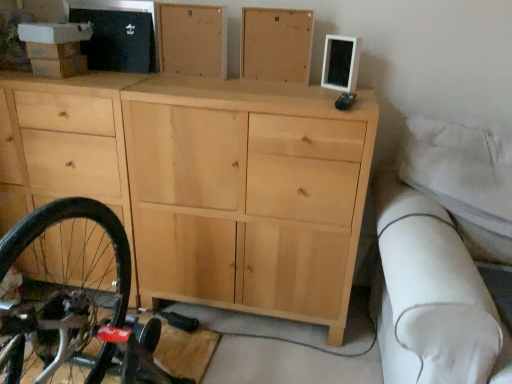
Question: From a real-world perspective, is natural wood cabinet at upper center, which is counted as the 1th chest of drawer, starting from the right, positioned over natural wood cabinet at upper center, which is the second chest of drawer from right to left, based on gravity?

Choices:
 (A) no
 (B) yes

Answer: (A)

Question: Is natural wood cabinet at upper center, which is the second chest of drawer from right to left, completely or partially inside natural wood cabinet at upper center, which is counted as the 1th chest of drawer, starting from the right?

Choices:
 (A) no
 (B) yes

Answer: (A)

Question: Is natural wood cabinet at upper center, which is counted as the 1th chest of drawer, starting from the right, not inside natural wood cabinet at upper center, which is the second chest of drawer from right to left?

Choices:
 (A) no
 (B) yes

Answer: (B)

Question: Considering the relative positions of natural wood cabinet at upper center, which is counted as the 1th chest of drawer, starting from the right, and natural wood cabinet at upper center, which is the second chest of drawer from right to left, in the image provided, is natural wood cabinet at upper center, which is counted as the 1th chest of drawer, starting from the right, to the left of natural wood cabinet at upper center, which is the second chest of drawer from right to left, from the viewer's perspective?

Choices:
 (A) no
 (B) yes

Answer: (A)

Question: Is natural wood cabinet at upper center, which is counted as the 1th chest of drawer, starting from the right, oriented away from natural wood cabinet at upper center, which ranks as the first chest of drawer in left-to-right order?

Choices:
 (A) no
 (B) yes

Answer: (A)

Question: Is natural wood cabinet at upper center, which is the second chest of drawer in left-to-right order, beside natural wood cabinet at upper center, which ranks as the first chest of drawer in left-to-right order?

Choices:
 (A) no
 (B) yes

Answer: (A)

Question: Is the position of natural wood cabinet at center less distant than that of natural wood cabinet at upper center, which is counted as the 1th chest of drawer, starting from the right?

Choices:
 (A) yes
 (B) no

Answer: (A)

Question: Would you say natural wood cabinet at upper center, which is counted as the 1th chest of drawer, starting from the right, is part of natural wood cabinet at center's contents?

Choices:
 (A) yes
 (B) no

Answer: (B)

Question: Is natural wood cabinet at center smaller than natural wood cabinet at upper center, which is counted as the 1th chest of drawer, starting from the right?

Choices:
 (A) no
 (B) yes

Answer: (A)

Question: Considering the relative sizes of natural wood cabinet at center and natural wood cabinet at upper center, which is counted as the 1th chest of drawer, starting from the right, in the image provided, is natural wood cabinet at center shorter than natural wood cabinet at upper center, which is counted as the 1th chest of drawer, starting from the right,?

Choices:
 (A) yes
 (B) no

Answer: (B)

Question: Could you tell me if natural wood cabinet at center is facing natural wood cabinet at upper center, which is the second chest of drawer in left-to-right order?

Choices:
 (A) yes
 (B) no

Answer: (B)

Question: Considering the relative sizes of natural wood cabinet at center and natural wood cabinet at upper center, which is the second chest of drawer in left-to-right order, in the image provided, is natural wood cabinet at center taller than natural wood cabinet at upper center, which is the second chest of drawer in left-to-right order,?

Choices:
 (A) no
 (B) yes

Answer: (B)

Question: Is natural wood cabinet at upper center, which is the second chest of drawer from right to left, not near natural wood cabinet at upper center, which is the second chest of drawer in left-to-right order?

Choices:
 (A) no
 (B) yes

Answer: (A)